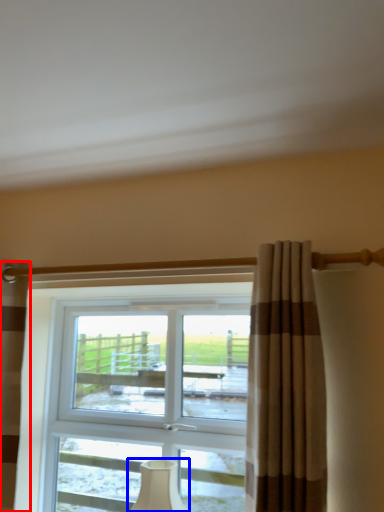
Question: Among these objects, which one is nearest to the camera, curtain (highlighted by a red box) or table lamp (highlighted by a blue box)?

Choices:
 (A) curtain
 (B) table lamp

Answer: (A)